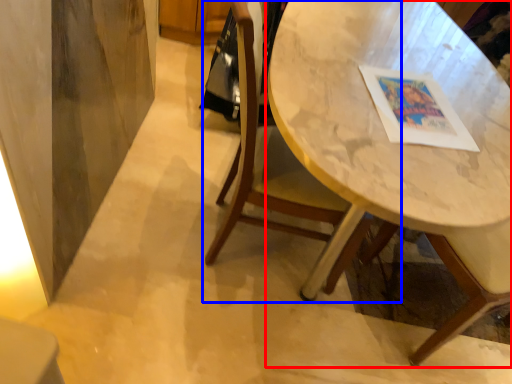
Question: Which object appears farthest to the camera in this image, table (highlighted by a red box) or chair (highlighted by a blue box)?

Choices:
 (A) table
 (B) chair

Answer: (B)